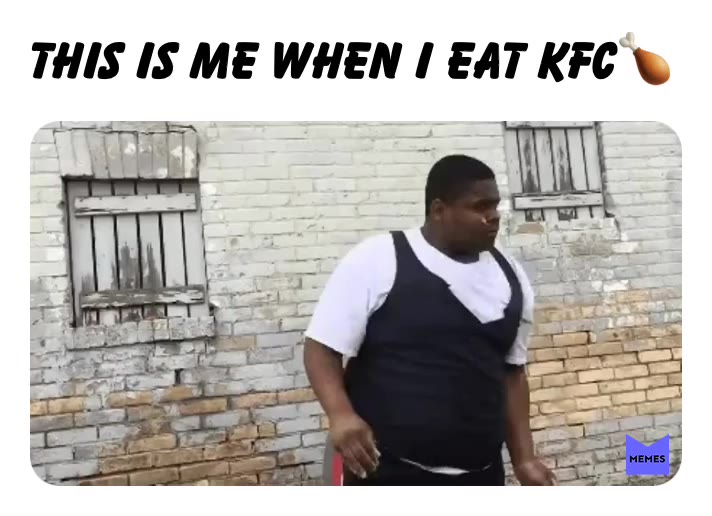
This screenshot has width=712, height=516. Identify the location of window. (609, 112), (182, 230).